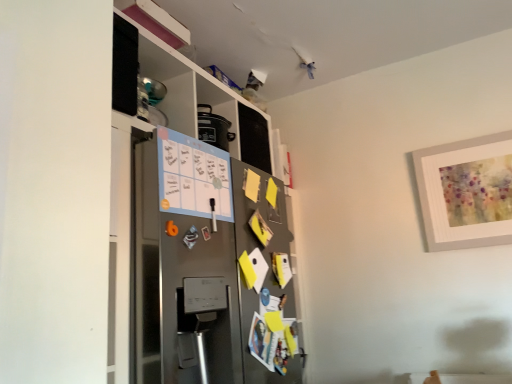
The height and width of the screenshot is (384, 512). What do you see at coordinates (208, 266) in the screenshot? I see `satin silver refrigerator at center` at bounding box center [208, 266].

Find the location of a particular element. This screenshot has height=384, width=512. satin silver refrigerator at center is located at coordinates click(x=208, y=266).

In order to click on satin silver refrigerator at center in this screenshot , I will do `click(208, 266)`.